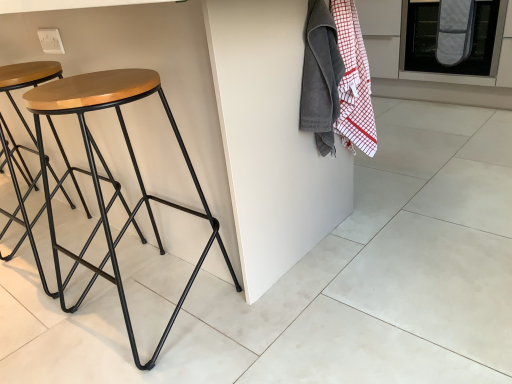
The height and width of the screenshot is (384, 512). What are the coordinates of `vacant space that is to the left of woodenmaterial/texturestool at left` in the screenshot? It's located at (58, 310).